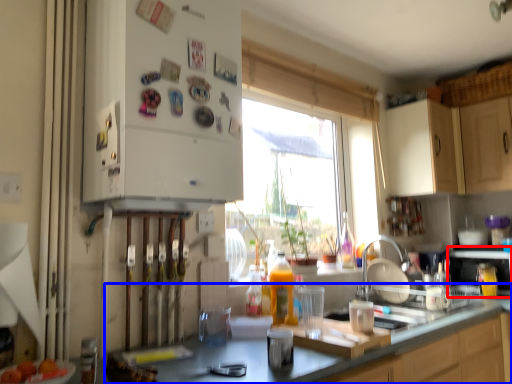
Question: Among these objects, which one is nearest to the camera, appliance (highlighted by a red box) or countertop (highlighted by a blue box)?

Choices:
 (A) appliance
 (B) countertop

Answer: (B)